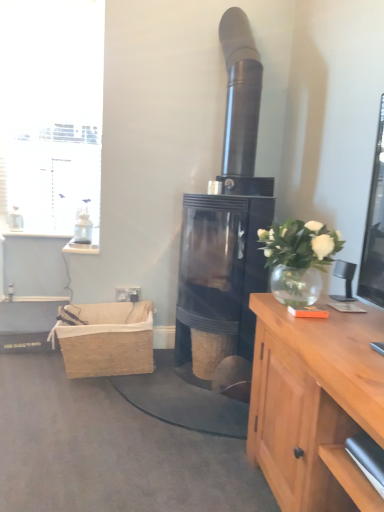
Describe the element at coordinates (51, 114) in the screenshot. I see `white glass window at upper left` at that location.

This screenshot has width=384, height=512. What do you see at coordinates (128, 294) in the screenshot?
I see `white plastic power outlet at center` at bounding box center [128, 294].

Describe the element at coordinates (210, 351) in the screenshot. I see `woven brown basket at center` at that location.

Describe the element at coordinates (106, 339) in the screenshot. I see `burlap picnic basket at lower left` at that location.

Identify the location of white glass window at upper left. (51, 114).

In the scene shown: Is black glass fireplace at center situated inside white glass vase at upper right or outside?

black glass fireplace at center is not enclosed by white glass vase at upper right.

Is black glass fireplace at center in contact with white glass vase at upper right?

No, black glass fireplace at center is not in contact with white glass vase at upper right.

Considering the positions of point (236, 137) and point (296, 305), is point (236, 137) closer or farther from the camera than point (296, 305)?

Point (236, 137) appears to be farther away from the viewer than point (296, 305).

Is black glass fireplace at center at the right side of white glass vase at upper right?

No, black glass fireplace at center is not to the right of white glass vase at upper right.

Between black glass fireplace at center and woven brown basket at center, which one has smaller width?

With smaller width is woven brown basket at center.

Based on the photo, could you tell me if black glass fireplace at center is facing woven brown basket at center?

Yes, black glass fireplace at center is facing woven brown basket at center.

Does black glass fireplace at center have a lesser height compared to woven brown basket at center?

No.

Is white plastic power outlet at center to the right of woven brown basket at center from the viewer's perspective?

In fact, white plastic power outlet at center is to the left of woven brown basket at center.

Looking at this image, who is taller, white plastic power outlet at center or woven brown basket at center?

woven brown basket at center is taller.

Which of these two, white plastic power outlet at center or woven brown basket at center, is smaller?

With smaller size is white plastic power outlet at center.

Considering the relative sizes of white plastic power outlet at center and woven brown basket at center in the image provided, is white plastic power outlet at center thinner than woven brown basket at center?

Yes.

From the image's perspective, is woven brown basket at center located above or below black glass fireplace at center?

woven brown basket at center is below black glass fireplace at center.

Which is in front, woven brown basket at center or black glass fireplace at center?

black glass fireplace at center is closer to the camera.

Which is in front, point (224, 344) or point (218, 192)?

The point (224, 344) is closer to the camera.

Who is taller, woven brown basket at center or black glass fireplace at center?

black glass fireplace at center.

Is burlap picnic basket at lower left positioned with its back to woven brown basket at center?

No, burlap picnic basket at lower left's orientation is not away from woven brown basket at center.

In terms of width, does burlap picnic basket at lower left look wider or thinner when compared to woven brown basket at center?

Clearly, burlap picnic basket at lower left has more width compared to woven brown basket at center.

Looking at the image, does burlap picnic basket at lower left seem bigger or smaller compared to woven brown basket at center?

Clearly, burlap picnic basket at lower left is larger in size than woven brown basket at center.

Does burlap picnic basket at lower left lie in front of woven brown basket at center?

Yes.

From the image's perspective, is white glass window at upper left above white plastic power outlet at center?

Yes, from the image's perspective, white glass window at upper left is over white plastic power outlet at center.

How much distance is there between white glass window at upper left and white plastic power outlet at center?

white glass window at upper left and white plastic power outlet at center are 4.87 feet apart.

In the image, is white glass window at upper left on the left side or the right side of white plastic power outlet at center?

Based on their positions, white glass window at upper left is located to the left of white plastic power outlet at center.

How distant is burlap picnic basket at lower left from white plastic power outlet at center?

burlap picnic basket at lower left is 14.16 inches from white plastic power outlet at center.

From a real-world perspective, between burlap picnic basket at lower left and white plastic power outlet at center, who is vertically lower?

In real-world perspective, burlap picnic basket at lower left is lower.

Which point is more distant from viewer, (57,325) or (120,296)?

The point (120,296) is more distant.

Is white plastic power outlet at center at the back of burlap picnic basket at lower left?

Yes, white plastic power outlet at center is at the back of burlap picnic basket at lower left.

Locate an element on the screen. The image size is (384, 512). fireplace that appears above the white glass vase at upper right (from a real-world perspective) is located at coordinates (225, 227).

Identify the location of basket beneath the black glass fireplace at center (from a real-world perspective). This screenshot has width=384, height=512. (210, 351).

Based on their spatial positions, is white plastic power outlet at center or white glass vase at upper right further from woven brown basket at center?

white glass vase at upper right is positioned further to the anchor woven brown basket at center.

From the image, which object appears to be nearer to woven brown basket at center, black glass fireplace at center or white glass vase at upper right?

black glass fireplace at center is closer to woven brown basket at center.

Looking at the image, which one is located further to woven brown basket at center, white plastic power outlet at center or white glass window at upper left?

white glass window at upper left lies further to woven brown basket at center than the other object.

When comparing their distances from white glass window at upper left, does burlap picnic basket at lower left or woven brown basket at center seem further?

woven brown basket at center lies further to white glass window at upper left than the other object.

From the image, which object appears to be farther from white glass vase at upper right, woven brown basket at center or white plastic power outlet at center?

white plastic power outlet at center.

When comparing their distances from white glass vase at upper right, does white glass window at upper left or woven brown basket at center seem closer?

woven brown basket at center is closer to white glass vase at upper right.

From the picture: Estimate the real-world distances between objects in this image. Which object is closer to woven brown basket at center, black glass fireplace at center or white plastic power outlet at center?

Among the two, black glass fireplace at center is located nearer to woven brown basket at center.

Looking at the image, which one is located closer to burlap picnic basket at lower left, woven brown basket at center or white plastic power outlet at center?

Based on the image, white plastic power outlet at center appears to be nearer to burlap picnic basket at lower left.

Identify the location of basket between white glass vase at upper right and white glass window at upper left from front to back. This screenshot has width=384, height=512. (210, 351).

Identify the location of power outlet between white glass window at upper left and woven brown basket at center in the vertical direction. The height and width of the screenshot is (512, 384). (128, 294).

Find the location of a particular element. picnic basket positioned between white glass vase at upper right and white glass window at upper left from near to far is located at coordinates (106, 339).

Identify the location of fireplace positioned between white glass vase at upper right and white glass window at upper left from near to far. (225, 227).